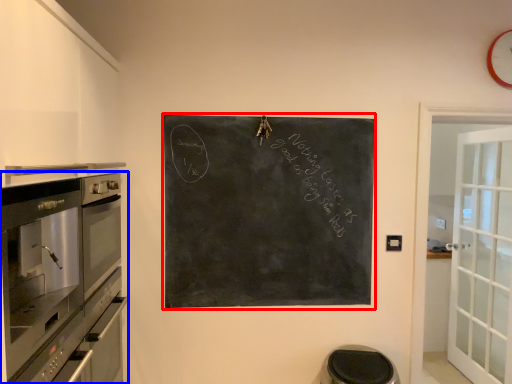
Question: Which object is closer to the camera taking this photo, bulletin board (highlighted by a red box) or home appliance (highlighted by a blue box)?

Choices:
 (A) bulletin board
 (B) home appliance

Answer: (B)